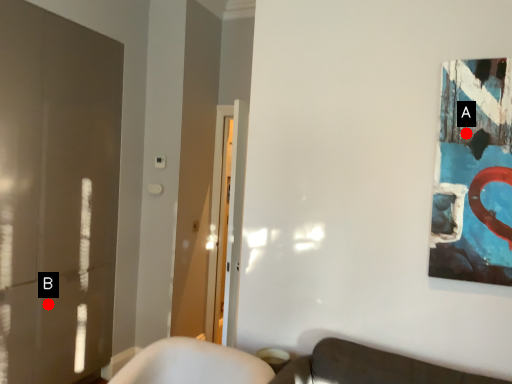
Question: Two points are circled on the image, labeled by A and B beside each circle. Among these points, which one is farthest from the camera?

Choices:
 (A) A is further
 (B) B is further

Answer: (B)